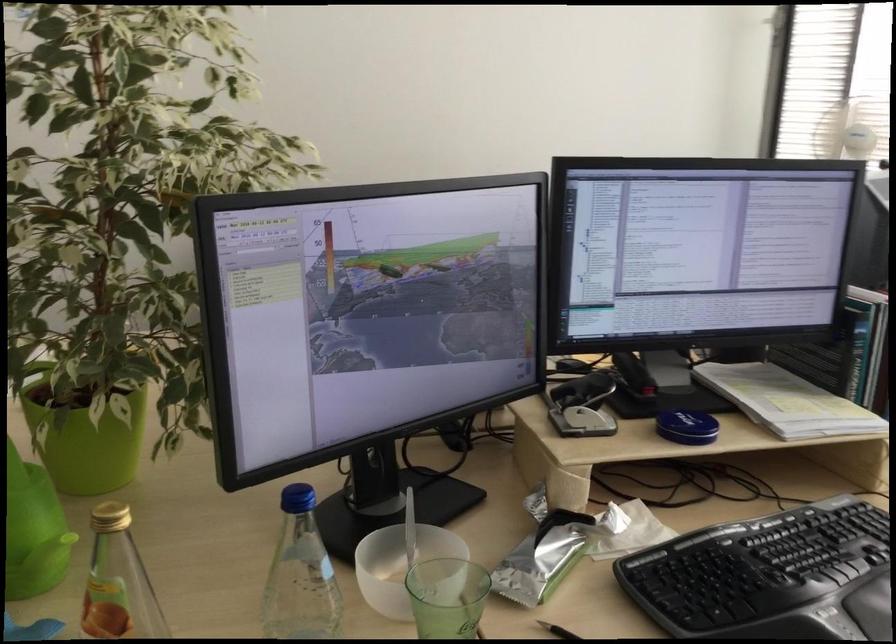
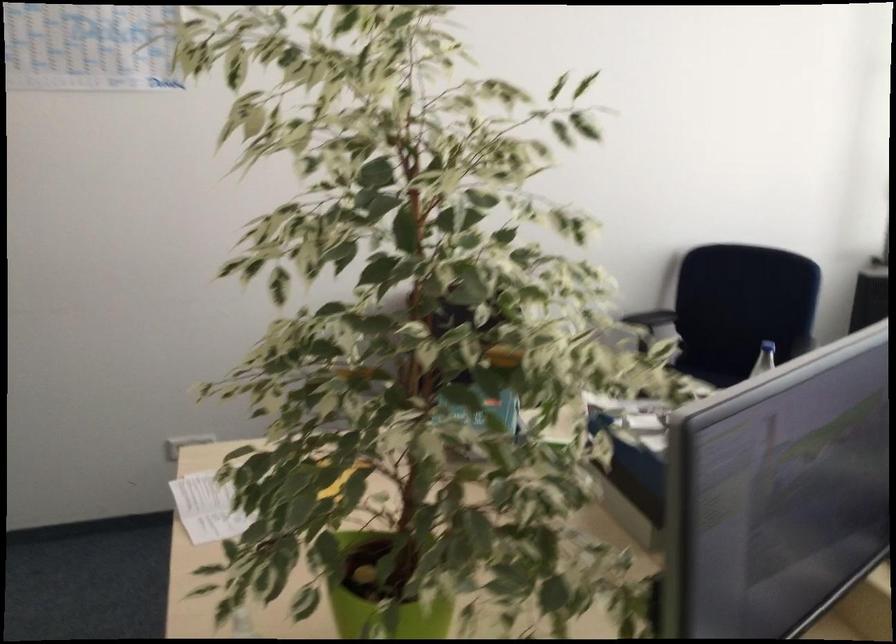
Question: The images are taken continuously from a first-person perspective. In which direction is your viewpoint rotating?

Choices:
 (A) Left
 (B) Right
 (C) Up
 (D) Down

Answer: (C)